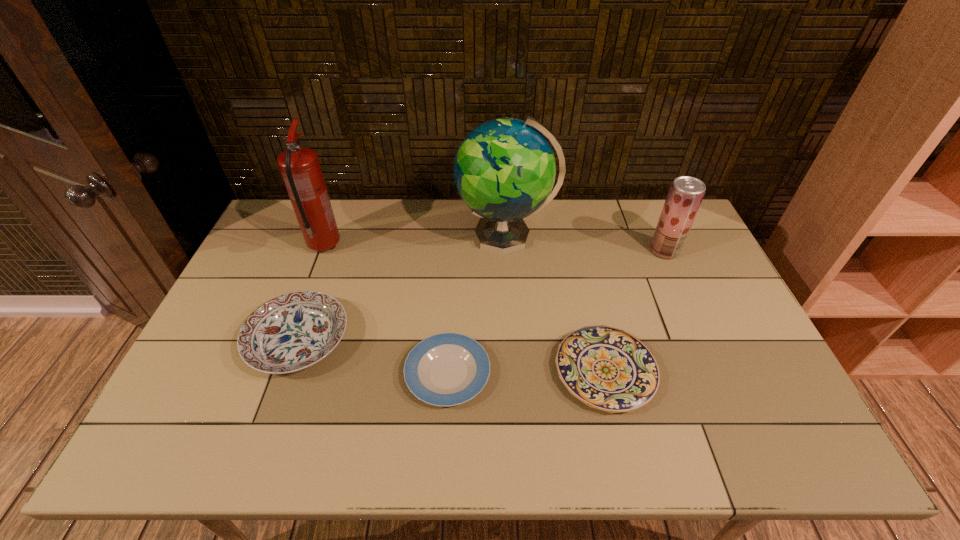
The width and height of the screenshot is (960, 540). In order to click on vacant space in between the second plate from left to right and the rightmost plate in this screenshot , I will do `click(526, 372)`.

Locate an element on the screen. vacant area that lies between the globe and the fourth tallest object is located at coordinates coord(402,288).

Find the location of a particular element. This screenshot has height=540, width=960. free space between the fruit juice and the rightmost plate is located at coordinates click(x=635, y=311).

This screenshot has width=960, height=540. In order to click on unoccupied position between the fire extinguisher and the globe in this screenshot , I will do `click(416, 241)`.

Find the location of a particular element. This screenshot has width=960, height=540. free space that is in between the globe and the rightmost plate is located at coordinates pos(556,304).

Locate an element on the screen. The width and height of the screenshot is (960, 540). free space that is in between the fruit juice and the rightmost plate is located at coordinates (635, 311).

Locate which object is the fourth closest to the rightmost plate. Please provide its 2D coordinates. Your answer should be formatted as a tuple, i.e. [(x, y)], where the tuple contains the x and y coordinates of a point satisfying the conditions above.

[(293, 331)]

In order to click on object identified as the fifth closest to the fourth shortest object in this screenshot , I will do `click(299, 166)`.

Where is `plate that is the nearest to the tallest plate`? The height and width of the screenshot is (540, 960). plate that is the nearest to the tallest plate is located at coordinates (447, 369).

Select which plate appears as the second closest to the second plate from left to right. Please provide its 2D coordinates. Your answer should be formatted as a tuple, i.e. [(x, y)], where the tuple contains the x and y coordinates of a point satisfying the conditions above.

[(606, 368)]